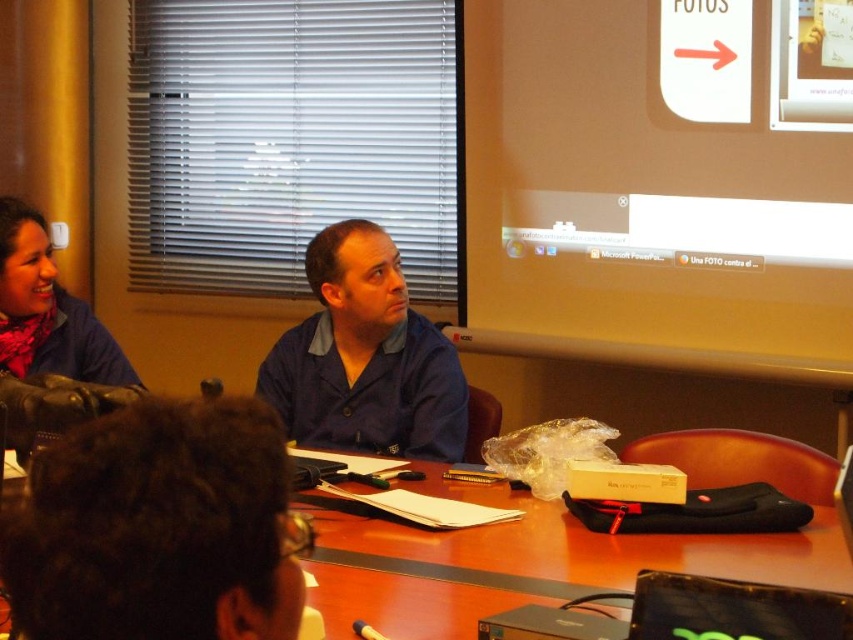
You are setting up for a presentation and need to position a projector that requires a clear line of sight to the white glossy projection screen at upper center. Given the coordinates provided, can you confirm if there are any objects on the table that might obstruct the projector beam to the screen?

The white glossy projection screen at upper center is located at point [651,189]. Since the table has items like papers, a pen, a plastic bag, a laptop, and a black carrying case, these objects might obstruct the projector beam depending on their placement. However, without specific spatial relationships between the table items and the screen coordinates, it is unclear if they block the path. Further details on the table items positions relative to the screen coordinates are needed to determine obtrusion

You are standing at the entrance of the room and see the dark brown hair at lower left and the brown wooden table at center. Which object is closer to your left side?

The dark brown hair at lower left is closer to your left side because it is positioned to the left of the brown wooden table at center.

You are standing in the room and want to point to the point located at coordinates (651, 189). Which object should you point at?

You should point at the white glossy projection screen at upper center because the point (651, 189) is located on it.